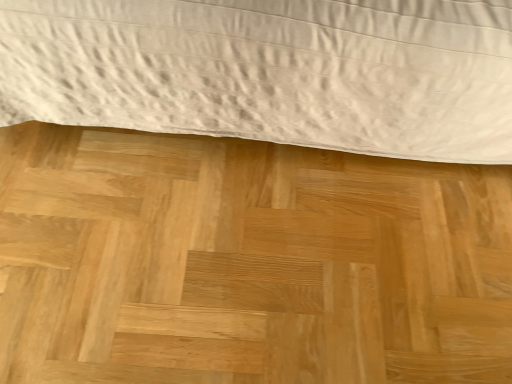
Question: From a real-world perspective, is natural wood plywood at center on top of white textured bed at upper center?

Choices:
 (A) yes
 (B) no

Answer: (B)

Question: Is natural wood plywood at center positioned beyond the bounds of white textured bed at upper center?

Choices:
 (A) no
 (B) yes

Answer: (B)

Question: From the image's perspective, is natural wood plywood at center below white textured bed at upper center?

Choices:
 (A) no
 (B) yes

Answer: (B)

Question: Is natural wood plywood at center positioned far away from white textured bed at upper center?

Choices:
 (A) no
 (B) yes

Answer: (A)

Question: Is the position of natural wood plywood at center less distant than that of white textured bed at upper center?

Choices:
 (A) no
 (B) yes

Answer: (A)

Question: Is natural wood plywood at center turned away from white textured bed at upper center?

Choices:
 (A) yes
 (B) no

Answer: (B)

Question: Is white textured bed at upper center positioned before natural wood plywood at center?

Choices:
 (A) yes
 (B) no

Answer: (A)

Question: From the image's perspective, is white textured bed at upper center over natural wood plywood at center?

Choices:
 (A) yes
 (B) no

Answer: (A)

Question: Considering the relative sizes of white textured bed at upper center and natural wood plywood at center in the image provided, is white textured bed at upper center shorter than natural wood plywood at center?

Choices:
 (A) no
 (B) yes

Answer: (A)

Question: Is white textured bed at upper center smaller than natural wood plywood at center?

Choices:
 (A) no
 (B) yes

Answer: (A)

Question: Is white textured bed at upper center facing towards natural wood plywood at center?

Choices:
 (A) no
 (B) yes

Answer: (B)

Question: From a real-world perspective, is white textured bed at upper center on top of natural wood plywood at center?

Choices:
 (A) yes
 (B) no

Answer: (A)

Question: Is white textured bed at upper center wider or thinner than natural wood plywood at center?

Choices:
 (A) wide
 (B) thin

Answer: (B)